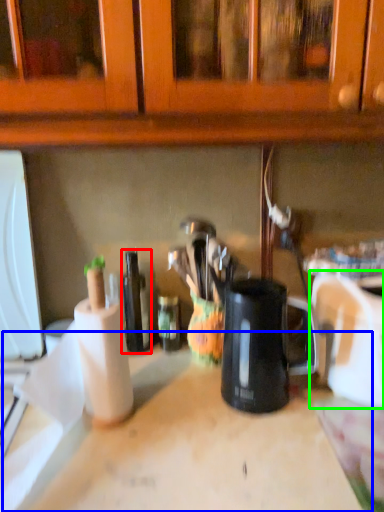
Question: Estimate the real-world distances between objects in this image. Which object is farther from bottle (highlighted by a red box), counter top (highlighted by a blue box) or appliance (highlighted by a green box)?

Choices:
 (A) counter top
 (B) appliance

Answer: (B)